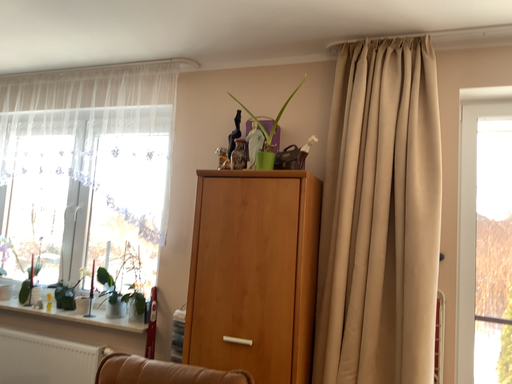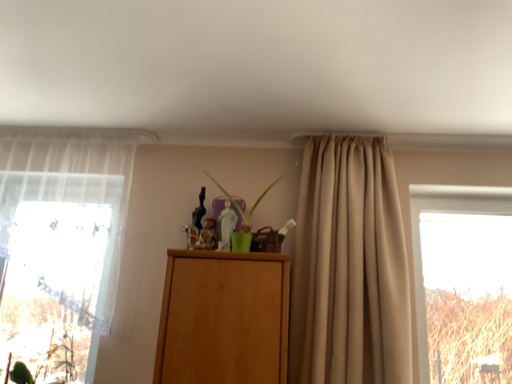
Question: How did the camera likely rotate when shooting the video?

Choices:
 (A) rotated right
 (B) rotated left

Answer: (A)